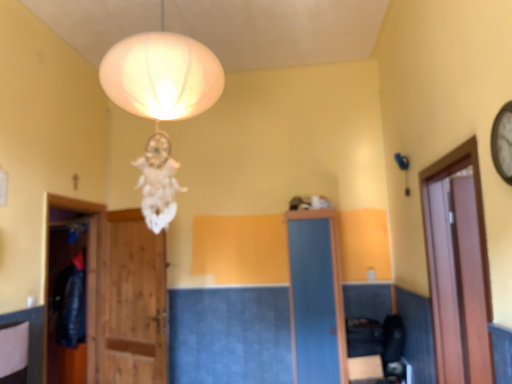
Question: Considering their positions, is brown wooden door at right located in front of or behind wooden door at center?

Choices:
 (A) behind
 (B) front

Answer: (B)

Question: Is point (484, 339) positioned closer to the camera than point (123, 211)?

Choices:
 (A) farther
 (B) closer

Answer: (B)

Question: In terms of width, does brown wooden door at right look wider or thinner when compared to wooden door at center?

Choices:
 (A) thin
 (B) wide

Answer: (B)

Question: Considering the positions of wooden door at center and brown wooden door at right in the image, is wooden door at center bigger or smaller than brown wooden door at right?

Choices:
 (A) big
 (B) small

Answer: (B)

Question: From the image's perspective, is wooden door at center positioned above or below brown wooden door at right?

Choices:
 (A) below
 (B) above

Answer: (A)

Question: Would you say wooden door at center is to the left or to the right of brown wooden door at right in the picture?

Choices:
 (A) left
 (B) right

Answer: (A)

Question: Which is correct: wooden door at center is inside brown wooden door at right, or outside of it?

Choices:
 (A) inside
 (B) outside

Answer: (B)